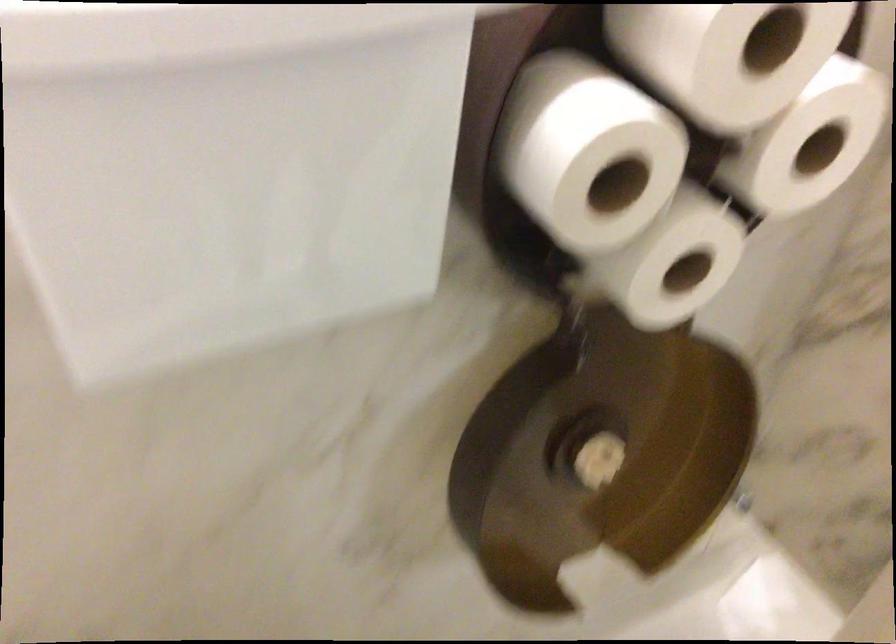
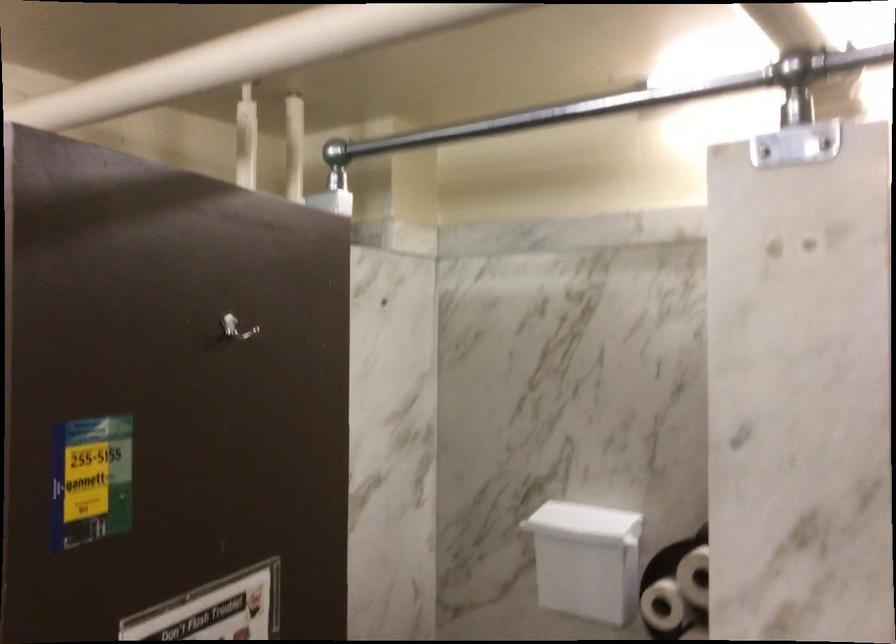
Where in the second image is the point corresponding to (556,199) from the first image?

(662, 605)